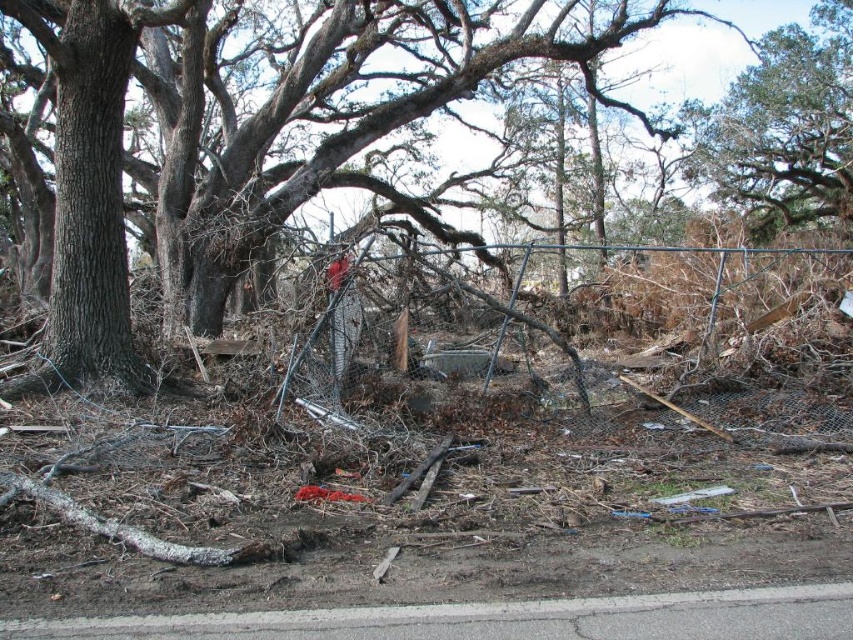
Question: Among these objects, which one is nearest to the camera?

Choices:
 (A) gray asphalt curb at lower center
 (B) brown textured tree at center
 (C) green leafy tree at upper right

Answer: (A)

Question: Which object appears farthest from the camera in this image?

Choices:
 (A) brown textured tree at center
 (B) gray asphalt curb at lower center
 (C) green leafy tree at upper right

Answer: (C)

Question: Which of the following is the closest to the observer?

Choices:
 (A) (785, 163)
 (B) (225, 624)

Answer: (B)

Question: Observing the image, what is the correct spatial positioning of brown textured tree at center in reference to green leafy tree at upper right?

Choices:
 (A) right
 (B) left

Answer: (B)

Question: Does gray asphalt curb at lower center appear on the left side of green leafy tree at upper right?

Choices:
 (A) no
 (B) yes

Answer: (B)

Question: In this image, where is brown textured tree at center located relative to green leafy tree at upper right?

Choices:
 (A) left
 (B) right

Answer: (A)